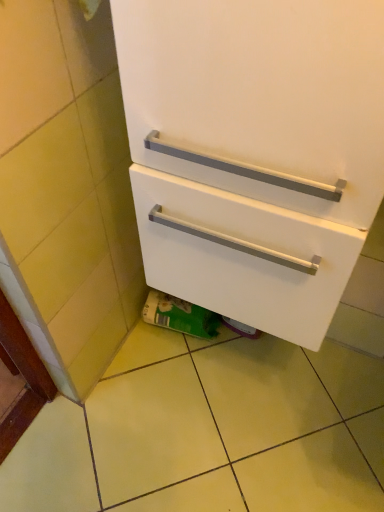
Find the location of a particular element. The width and height of the screenshot is (384, 512). white matte cabinet at center is located at coordinates coord(254,151).

The image size is (384, 512). Describe the element at coordinates (254, 151) in the screenshot. I see `white matte cabinet at center` at that location.

Image resolution: width=384 pixels, height=512 pixels. Find the location of `white matte cabinet at center`. white matte cabinet at center is located at coordinates (254, 151).